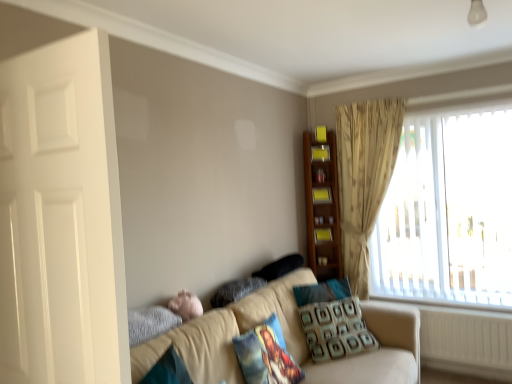
Question: From the image's perspective, relative to white plastic radiator at lower right, is yellow matte bookshelf at upper right, the 2th shelf viewed from the top, above or below?

Choices:
 (A) below
 (B) above

Answer: (B)

Question: From a real-world perspective, is yellow matte bookshelf at upper right, the 2th shelf viewed from the top, positioned above or below white plastic radiator at lower right?

Choices:
 (A) above
 (B) below

Answer: (A)

Question: Which is nearer to the black fabric pillow at center, the 4th pillow viewed from the front?

Choices:
 (A) wooden shelf at upper right, which is the first shelf in top-to-bottom order
 (B) yellow matte bookshelf at upper right, which ranks as the 2th shelf in bottom-to-top order
 (C) beige fabric couch at lower center
 (D) patterned fabric pillow at lower right, which is counted as the third pillow, starting from the front
 (E) white glossy door at left

Answer: (D)

Question: Which object is positioned farthest from the patterned fabric pillow at lower right, which is counted as the third pillow, starting from the front?

Choices:
 (A) white glossy door at left
 (B) wooden bookshelf at upper right, acting as the 1th shelf starting from the bottom
 (C) wooden shelf at upper right, which is the first shelf in top-to-bottom order
 (D) yellow matte bookshelf at upper right, which ranks as the 2th shelf in bottom-to-top order
 (E) beige textured curtain at upper right

Answer: (A)